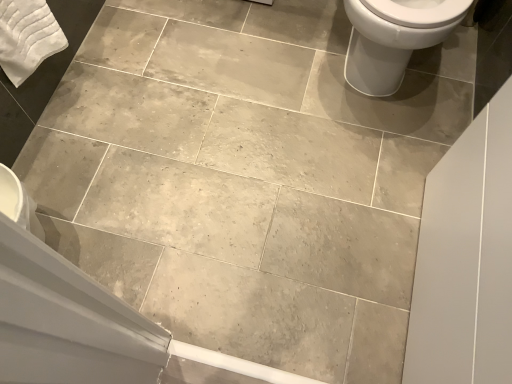
Question: Is white glossy toilet at upper right located outside white cotton bath towel at upper left?

Choices:
 (A) no
 (B) yes

Answer: (B)

Question: Does white glossy toilet at upper right have a greater height compared to white cotton bath towel at upper left?

Choices:
 (A) no
 (B) yes

Answer: (B)

Question: Is white glossy toilet at upper right positioned with its back to white cotton bath towel at upper left?

Choices:
 (A) yes
 (B) no

Answer: (B)

Question: From the image's perspective, is white glossy toilet at upper right over white cotton bath towel at upper left?

Choices:
 (A) no
 (B) yes

Answer: (B)

Question: From a real-world perspective, is white glossy toilet at upper right over white cotton bath towel at upper left?

Choices:
 (A) yes
 (B) no

Answer: (B)

Question: Is white glossy toilet at upper right not close to white cotton bath towel at upper left?

Choices:
 (A) no
 (B) yes

Answer: (B)

Question: Would you consider white cotton bath towel at upper left to be distant from white glossy toilet at upper right?

Choices:
 (A) yes
 (B) no

Answer: (A)

Question: Is white cotton bath towel at upper left placed right next to white glossy toilet at upper right?

Choices:
 (A) no
 (B) yes

Answer: (A)

Question: Is white glossy toilet at upper right completely or partially inside white cotton bath towel at upper left?

Choices:
 (A) yes
 (B) no

Answer: (B)

Question: Is white cotton bath towel at upper left wider than white glossy toilet at upper right?

Choices:
 (A) yes
 (B) no

Answer: (B)

Question: Is white cotton bath towel at upper left oriented away from white glossy toilet at upper right?

Choices:
 (A) no
 (B) yes

Answer: (A)

Question: Is white cotton bath towel at upper left not inside white glossy toilet at upper right?

Choices:
 (A) yes
 (B) no

Answer: (A)

Question: Considering the positions of white glossy toilet at upper right and white cotton bath towel at upper left in the image, is white glossy toilet at upper right bigger or smaller than white cotton bath towel at upper left?

Choices:
 (A) big
 (B) small

Answer: (A)